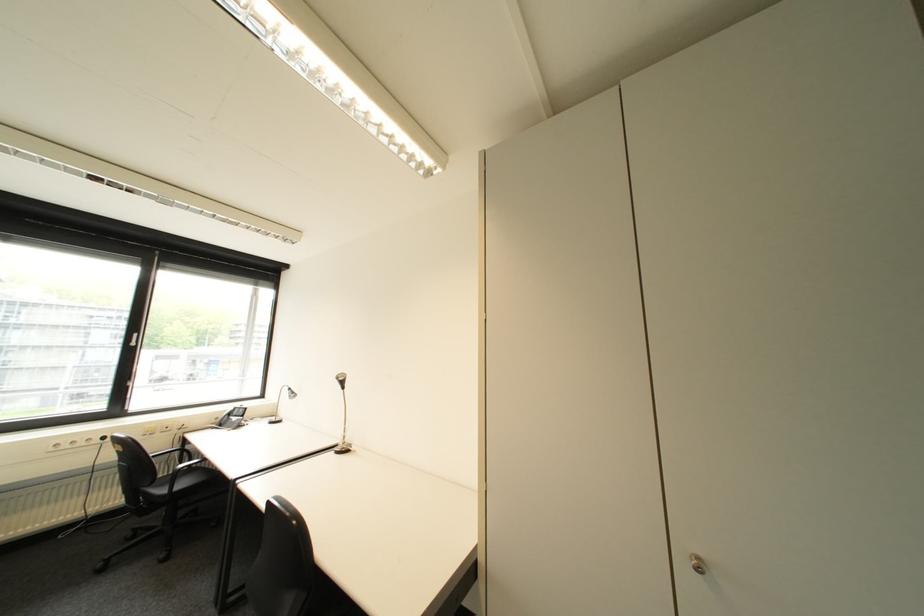
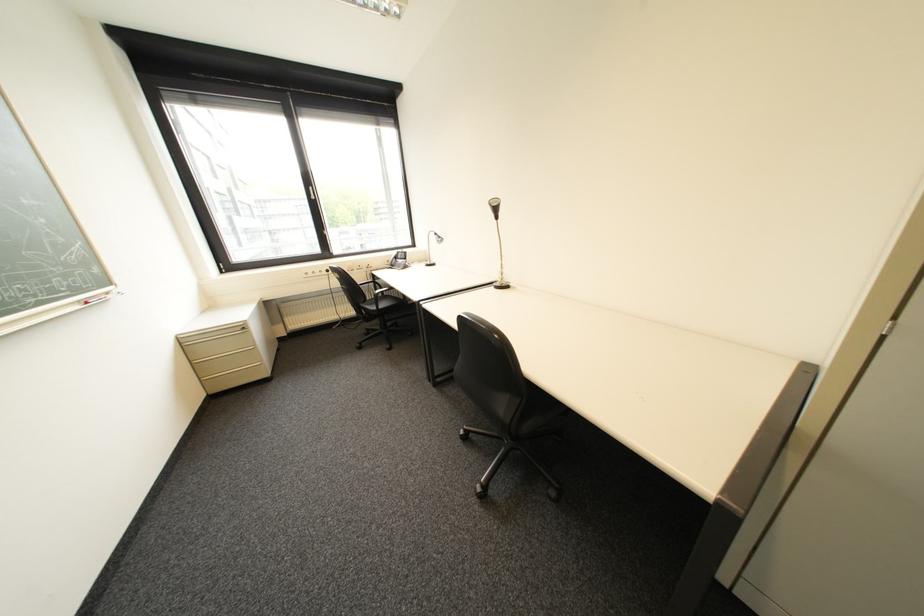
How did the camera likely rotate?

The camera's rotation is toward left-down.